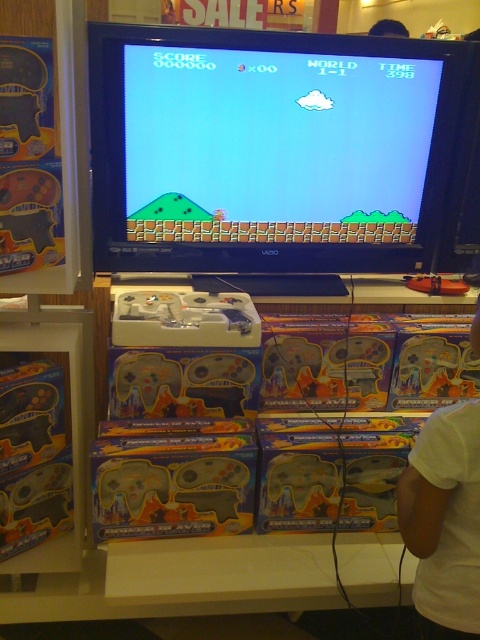
Is matte plastic video game at center wider than white cotton shirt at lower right?

Correct, the width of matte plastic video game at center exceeds that of white cotton shirt at lower right.

Locate an element on the screen. matte plastic video game at center is located at coordinates (276, 150).

Is point (208, 218) closer to camera compared to point (443, 589)?

No, it is behind (443, 589).

Find the location of `matte plastic video game at center`. matte plastic video game at center is located at coordinates (276, 150).